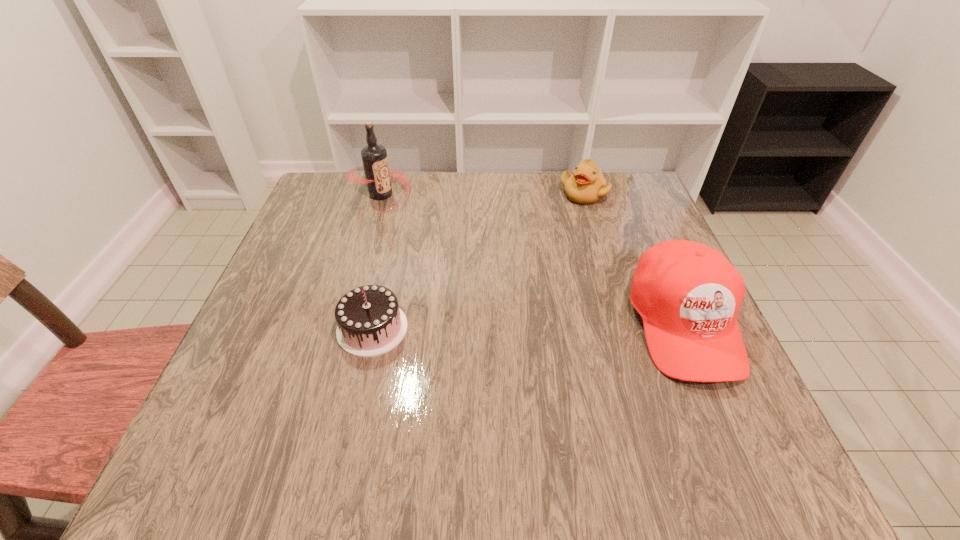
Where is `vacant space on the desktop that is between the chocolate cake and the second tallest object and is positioned on the front-facing side of the duckling`? Image resolution: width=960 pixels, height=540 pixels. vacant space on the desktop that is between the chocolate cake and the second tallest object and is positioned on the front-facing side of the duckling is located at coordinates (525, 326).

At what (x,y) coordinates should I click in order to perform the action: click on vacant space on the desktop that is between the chocolate cake and the baseball cap and is positioned on the label of the tallest object. Please return your answer as a coordinate pair (x, y). Looking at the image, I should click on (522, 326).